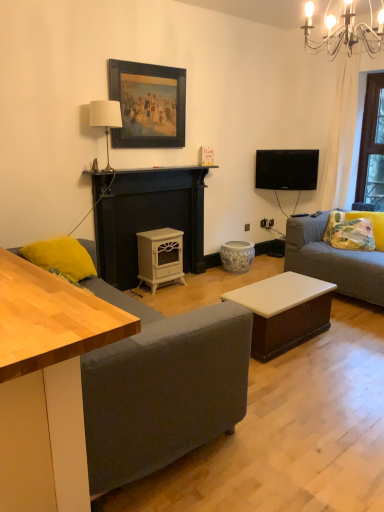
Describe the element at coordinates (287, 169) in the screenshot. The height and width of the screenshot is (512, 384). I see `black glossy tv at upper right` at that location.

What are the coordinates of `floral fabric pillow at right, arranged as the 1th pillow when viewed from the back` in the screenshot? It's located at (349, 232).

The width and height of the screenshot is (384, 512). Describe the element at coordinates (333, 260) in the screenshot. I see `gray fabric couch at right` at that location.

Image resolution: width=384 pixels, height=512 pixels. I want to click on white glossy wood stove at center, so click(160, 257).

The image size is (384, 512). I want to click on black glossy tv at upper right, so click(x=287, y=169).

From a real-world perspective, is white glossy wood stove at center positioned over black glossy tv at upper right based on gravity?

No, from a real-world perspective, white glossy wood stove at center is not on top of black glossy tv at upper right.

Is white glossy wood stove at center outside of black glossy tv at upper right?

white glossy wood stove at center lies outside black glossy tv at upper right's area.

Considering the positions of objects white glossy wood stove at center and black glossy tv at upper right in the image provided, who is more to the right, white glossy wood stove at center or black glossy tv at upper right?

black glossy tv at upper right is more to the right.

Between point (169, 229) and point (279, 184), which one is positioned behind?

The point (279, 184) is farther.

Based on the photo, can you confirm if black glossy tv at upper right is shorter than white glossy coffee table at center?

No, black glossy tv at upper right is not shorter than white glossy coffee table at center.

Is the surface of black glossy tv at upper right in direct contact with white glossy coffee table at center?

No, black glossy tv at upper right is not in contact with white glossy coffee table at center.

In terms of size, does black glossy tv at upper right appear bigger or smaller than white glossy coffee table at center?

Clearly, black glossy tv at upper right is smaller in size than white glossy coffee table at center.

From the image's perspective, does porcelain floral-patterned stool at center appear lower than dark gray fabric couch at lower left?

Actually, porcelain floral-patterned stool at center appears above dark gray fabric couch at lower left in the image.

Is porcelain floral-patterned stool at center touching dark gray fabric couch at lower left?

No, porcelain floral-patterned stool at center is not beside dark gray fabric couch at lower left.

Considering the sizes of objects porcelain floral-patterned stool at center and dark gray fabric couch at lower left in the image provided, who is taller, porcelain floral-patterned stool at center or dark gray fabric couch at lower left?

porcelain floral-patterned stool at center is taller.

Is white fabric lampshade at upper center oriented towards white glossy coffee table at center?

No, white fabric lampshade at upper center is not oriented towards white glossy coffee table at center.

Is white fabric lampshade at upper center in front of or behind white glossy coffee table at center in the image?

In the image, white fabric lampshade at upper center appears behind white glossy coffee table at center.

From a real-world perspective, is white fabric lampshade at upper center positioned under white glossy coffee table at center based on gravity?

No, from a real-world perspective, white fabric lampshade at upper center is not under white glossy coffee table at center.

Is white fabric lampshade at upper center shorter than white glossy coffee table at center?

In fact, white fabric lampshade at upper center may be taller than white glossy coffee table at center.

From a real-world perspective, which is physically above, dark gray fabric couch at lower left or white glossy coffee table at center?

white glossy coffee table at center.

Who is bigger, dark gray fabric couch at lower left or white glossy coffee table at center?

dark gray fabric couch at lower left is bigger.

How distant is dark gray fabric couch at lower left from white glossy coffee table at center?

The distance of dark gray fabric couch at lower left from white glossy coffee table at center is 34.87 inches.

Does dark gray fabric couch at lower left turn towards white glossy coffee table at center?

No, dark gray fabric couch at lower left is not facing towards white glossy coffee table at center.

In order to click on stool that appears behind the gray fabric couch at right in this screenshot , I will do `click(237, 256)`.

Considering the sizes of porcelain floral-patterned stool at center and gray fabric couch at right in the image, is porcelain floral-patterned stool at center wider or thinner than gray fabric couch at right?

porcelain floral-patterned stool at center is thinner than gray fabric couch at right.

Between point (243, 248) and point (316, 253), which one is positioned in front?

The point (316, 253) is closer.

Identify the location of light fixture that is above the black glossy tv at upper right (from a real-world perspective). (344, 31).

Considering the sizes of objects black glossy tv at upper right and metallic chandelier at upper right in the image provided, who is thinner, black glossy tv at upper right or metallic chandelier at upper right?

Thinner between the two is black glossy tv at upper right.

Is black glossy tv at upper right to the left of metallic chandelier at upper right from the viewer's perspective?

No, black glossy tv at upper right is not to the left of metallic chandelier at upper right.

From a real-world perspective, is black glossy tv at upper right positioned above or below metallic chandelier at upper right?

black glossy tv at upper right is below metallic chandelier at upper right.

There is a white glossy wood stove at center. Identify the location of television above it (from a real-world perspective). (287, 169).

The height and width of the screenshot is (512, 384). I want to click on table that appears on the left of black glossy tv at upper right, so click(x=284, y=311).

In the scene shown: Estimate the real-world distances between objects in this image. Which object is closer to yellow fluffy pillow at left, positioned as the 1th pillow in left-to-right order, black glossy tv at upper right or dark gray fabric couch at lower left?

dark gray fabric couch at lower left is positioned closer to the anchor yellow fluffy pillow at left, positioned as the 1th pillow in left-to-right order.

Based on their spatial positions, is gray fabric couch at right or porcelain floral-patterned stool at center further from floral fabric pillow at right, positioned as the 1th pillow in right-to-left order?

porcelain floral-patterned stool at center.

Estimate the real-world distances between objects in this image. Which object is further from porcelain floral-patterned stool at center, wooden picture frame at upper center or gray fabric couch at right?

wooden picture frame at upper center.

Estimate the real-world distances between objects in this image. Which object is closer to wooden picture frame at upper center, porcelain floral-patterned stool at center or yellow fluffy pillow at left, placed as the second pillow when sorted from back to front?

The object closer to wooden picture frame at upper center is yellow fluffy pillow at left, placed as the second pillow when sorted from back to front.

From the image, which object appears to be farther from white matte wood stove at center, white glossy wood stove at center or floral fabric pillow at right, positioned as the 1th pillow in right-to-left order?

floral fabric pillow at right, positioned as the 1th pillow in right-to-left order.

Based on their spatial positions, is floral fabric pillow at right, arranged as the 1th pillow when viewed from the back, or wooden picture frame at upper center closer to metallic chandelier at upper right?

wooden picture frame at upper center is closer to metallic chandelier at upper right.

Based on their spatial positions, is wooden picture frame at upper center or gray fabric couch at right closer to yellow fluffy pillow at left, the 2th pillow in the right-to-left sequence?

The object closer to yellow fluffy pillow at left, the 2th pillow in the right-to-left sequence, is wooden picture frame at upper center.

In the scene shown: Estimate the real-world distances between objects in this image. Which object is further from dark gray fabric couch at lower left, black glossy tv at upper right or floral fabric pillow at right, positioned as the 1th pillow in right-to-left order?

black glossy tv at upper right lies further to dark gray fabric couch at lower left than the other object.

Locate an element on the screen. Image resolution: width=384 pixels, height=512 pixels. fireplace situated between yellow fluffy pillow at left, arranged as the 1th pillow when viewed from the front, and white glossy coffee table at center from left to right is located at coordinates (149, 219).

Locate an element on the screen. light fixture located between dark gray fabric couch at lower left and white glossy wood stove at center in the depth direction is located at coordinates (344, 31).

You are a GUI agent. You are given a task and a screenshot of the screen. Output one action in this format:
    pyautogui.click(x=<x>, y=<y>)
    Task: Click on the picture frame between metallic chandelier at upper right and white glossy wood stove at center from front to back
    The image size is (384, 512).
    Given the screenshot: What is the action you would take?
    pyautogui.click(x=148, y=104)

Find the location of a particular element. This screenshot has height=512, width=384. table that lies between wooden picture frame at upper center and dark gray fabric couch at lower left from top to bottom is located at coordinates (284, 311).